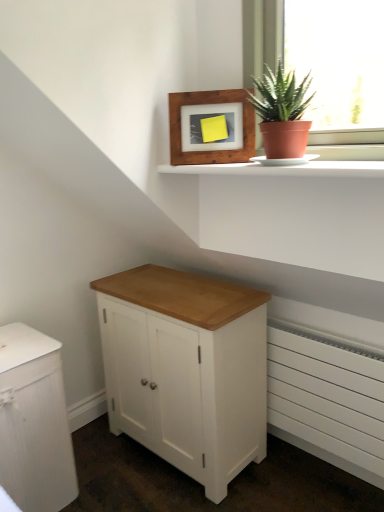
Question: Considering the positions of wooden frame at upper center and white wood cabinet at lower left, which is the second chest of drawers from right to left, in the image, is wooden frame at upper center bigger or smaller than white wood cabinet at lower left, which is the second chest of drawers from right to left,?

Choices:
 (A) big
 (B) small

Answer: (B)

Question: Is wooden frame at upper center inside the boundaries of white wood cabinet at lower left, the 1th chest of drawers from the left, or outside?

Choices:
 (A) inside
 (B) outside

Answer: (B)

Question: Estimate the real-world distances between objects in this image. Which object is farther from the white wood cabinet at center, acting as the first chest of drawers starting from the right?

Choices:
 (A) white wood cabinet at lower left, which is the second chest of drawers from right to left
 (B) green matte plant at upper right
 (C) white matte radiator at lower right
 (D) wooden frame at upper center
 (E) white smooth window sill at upper center

Answer: (B)

Question: Which of these objects is positioned farthest from the green matte plant at upper right?

Choices:
 (A) white wood cabinet at center, acting as the first chest of drawers starting from the right
 (B) white wood cabinet at lower left, which is the second chest of drawers from right to left
 (C) wooden frame at upper center
 (D) white matte radiator at lower right
 (E) white smooth window sill at upper center

Answer: (B)